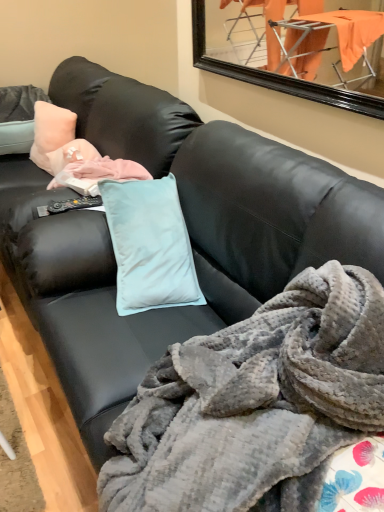
Measure the distance between peach velvety pillow at upper left and camera.

The depth of peach velvety pillow at upper left is 6.46 feet.

I want to click on peach velvety pillow at upper left, so click(52, 136).

What do you see at coordinates (52, 136) in the screenshot? I see `peach velvety pillow at upper left` at bounding box center [52, 136].

What do you see at coordinates (253, 399) in the screenshot? I see `gray plush blanket at center` at bounding box center [253, 399].

At what (x,y) coordinates should I click in order to perform the action: click on gray plush blanket at center. Please return your answer as a coordinate pair (x, y). This screenshot has width=384, height=512. Looking at the image, I should click on [253, 399].

Measure the distance between gray plush blanket at center and camera.

25.75 inches.

You are a GUI agent. You are given a task and a screenshot of the screen. Output one action in this format:
    pyautogui.click(x=<x>, y=<y>)
    Task: Click on the peach velvety pillow at upper left
    This screenshot has width=384, height=512.
    Given the screenshot: What is the action you would take?
    pyautogui.click(x=52, y=136)

Considering the relative positions of gray plush blanket at center and peach velvety pillow at upper left in the image provided, is gray plush blanket at center to the left or to the right of peach velvety pillow at upper left?

Based on their positions, gray plush blanket at center is located to the right of peach velvety pillow at upper left.

Considering their positions, is gray plush blanket at center located in front of or behind peach velvety pillow at upper left?

In the image, gray plush blanket at center appears in front of peach velvety pillow at upper left.

Considering the positions of points (164, 407) and (40, 140), is point (164, 407) farther from camera compared to point (40, 140)?

No.

From the image's perspective, is gray plush blanket at center on peach velvety pillow at upper left?

No, from the image's perspective, gray plush blanket at center is not above peach velvety pillow at upper left.

From a real-world perspective, is gray plush blanket at center positioned above or below peach velvety pillow at upper left?

From a real-world perspective, gray plush blanket at center is physically below peach velvety pillow at upper left.

Can you confirm if gray plush blanket at center is thinner than peach velvety pillow at upper left?

In fact, gray plush blanket at center might be wider than peach velvety pillow at upper left.

Considering the sizes of objects gray plush blanket at center and peach velvety pillow at upper left in the image provided, who is taller, gray plush blanket at center or peach velvety pillow at upper left?

With more height is gray plush blanket at center.

In the scene shown: Is gray plush blanket at center smaller than peach velvety pillow at upper left?

Incorrect, gray plush blanket at center is not smaller in size than peach velvety pillow at upper left.

Is gray plush blanket at center completely or partially outside of peach velvety pillow at upper left?

gray plush blanket at center is positioned outside peach velvety pillow at upper left.

Is gray plush blanket at center directly adjacent to peach velvety pillow at upper left?

No, gray plush blanket at center is not making contact with peach velvety pillow at upper left.

Is gray plush blanket at center positioned with its back to peach velvety pillow at upper left?

gray plush blanket at center is not turned away from peach velvety pillow at upper left.

Where is `pillow above the gray plush blanket at center (from the image's perspective)`? This screenshot has width=384, height=512. pillow above the gray plush blanket at center (from the image's perspective) is located at coordinates (52, 136).

Is peach velvety pillow at upper left at the right side of gray plush blanket at center?

Incorrect, peach velvety pillow at upper left is not on the right side of gray plush blanket at center.

Is the depth of peach velvety pillow at upper left less than that of gray plush blanket at center?

No, it is behind gray plush blanket at center.

Does point (41, 106) appear closer or farther from the camera than point (125, 507)?

Point (41, 106) appears to be farther away from the viewer than point (125, 507).

From the image's perspective, who appears lower, peach velvety pillow at upper left or gray plush blanket at center?

gray plush blanket at center.

From a real-world perspective, who is located higher, peach velvety pillow at upper left or gray plush blanket at center?

In real-world perspective, peach velvety pillow at upper left is above.

Can you confirm if peach velvety pillow at upper left is wider than gray plush blanket at center?

No.

From their relative heights in the image, would you say peach velvety pillow at upper left is taller or shorter than gray plush blanket at center?

peach velvety pillow at upper left is shorter than gray plush blanket at center.

Looking at this image, between peach velvety pillow at upper left and gray plush blanket at center, which one has smaller size?

With smaller size is peach velvety pillow at upper left.

Looking at this image, is peach velvety pillow at upper left positioned beyond the bounds of gray plush blanket at center?

Yes, peach velvety pillow at upper left is outside of gray plush blanket at center.

Are peach velvety pillow at upper left and gray plush blanket at center making contact?

peach velvety pillow at upper left and gray plush blanket at center are not in contact.

Is peach velvety pillow at upper left aimed at gray plush blanket at center?

No.

Looking at this image, measure the distance from peach velvety pillow at upper left to gray plush blanket at center.

The distance of peach velvety pillow at upper left from gray plush blanket at center is 5.11 feet.

At what (x,y) coordinates should I click in order to perform the action: click on pillow located behind the gray plush blanket at center. Please return your answer as a coordinate pair (x, y). This screenshot has width=384, height=512. Looking at the image, I should click on (52, 136).

Locate an element on the screen. Image resolution: width=384 pixels, height=512 pixels. blanket that is under the peach velvety pillow at upper left (from a real-world perspective) is located at coordinates (253, 399).

Locate an element on the screen. Image resolution: width=384 pixels, height=512 pixels. pillow behind the gray plush blanket at center is located at coordinates (52, 136).